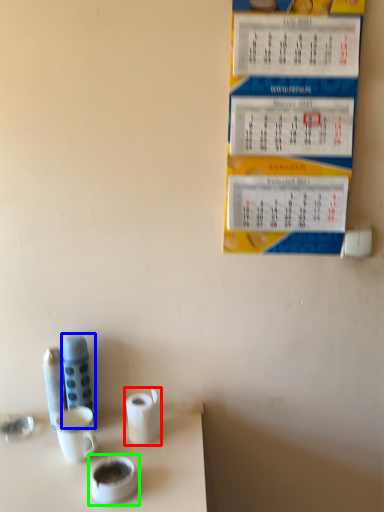
Question: Based on their relative distances, which object is nearer to toilet paper (highlighted by a red box)? Choose from stationery (highlighted by a blue box) and teacup (highlighted by a green box).

Choices:
 (A) stationery
 (B) teacup

Answer: (B)